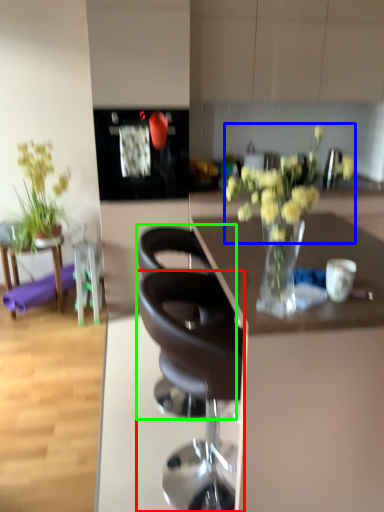
Question: Which object is the farthest from chair (highlighted by a red box)? Choose among these: flower (highlighted by a blue box) or chair (highlighted by a green box).

Choices:
 (A) flower
 (B) chair

Answer: (A)